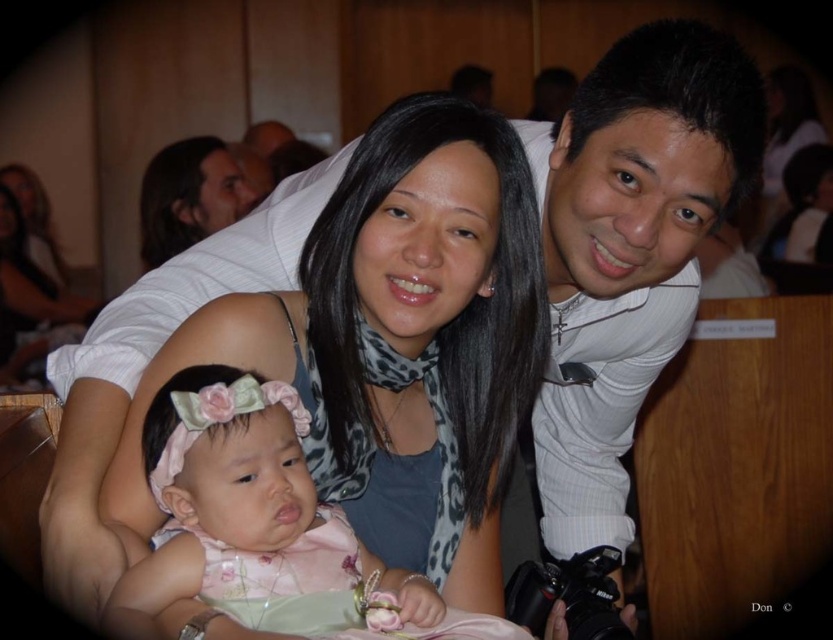
Who is higher up, pink satin dress at center or matte black scarf at upper center?

matte black scarf at upper center

Can you confirm if pink satin dress at center is shorter than matte black scarf at upper center?

Correct, pink satin dress at center is not as tall as matte black scarf at upper center.

Is point (162, 460) positioned behind point (160, 260)?

No.

The width and height of the screenshot is (833, 640). What are the coordinates of `pink satin dress at center` in the screenshot? It's located at (257, 513).

Which is more to the right, matte gray scarf at center or pink satin dress at center?

matte gray scarf at center

Image resolution: width=833 pixels, height=640 pixels. Identify the location of matte gray scarf at center. (393, 346).

Is point (408, 458) in front of point (160, 236)?

Yes, it is in front of point (160, 236).

Between matte gray scarf at center and matte black scarf at upper center, which one appears on the right side from the viewer's perspective?

From the viewer's perspective, matte gray scarf at center appears more on the right side.

Which is behind, point (383, 541) or point (153, 225)?

The point (153, 225) is more distant.

Find the location of `matte gray scarf at center`. matte gray scarf at center is located at coordinates (393, 346).